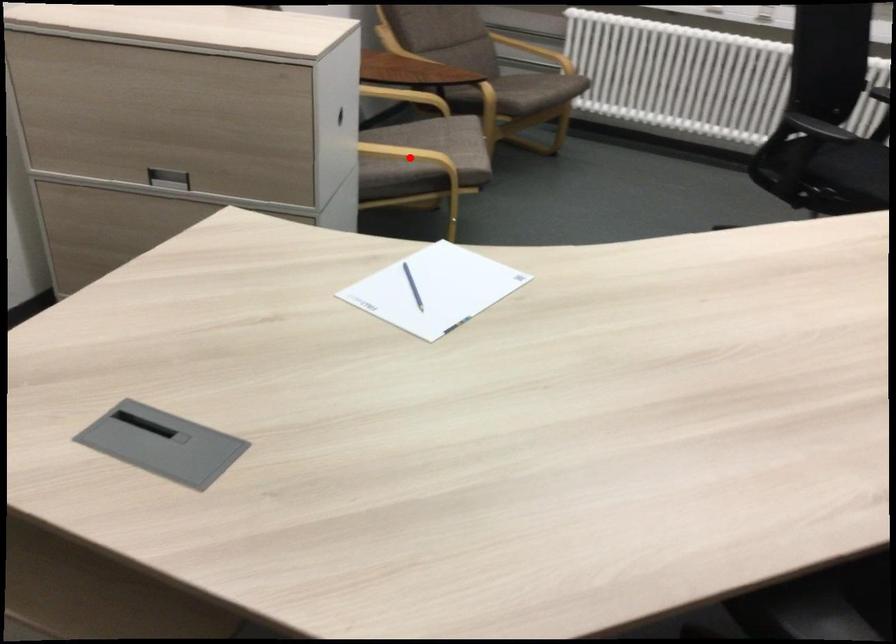
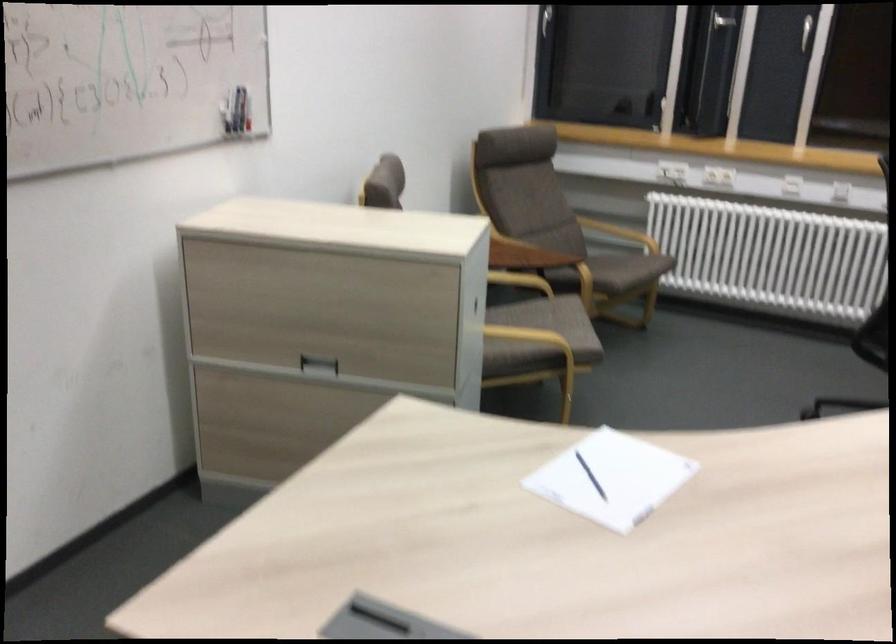
Question: I am providing you with two images of the same scene from different viewpoints. A red point is marked on the first image. Can you still see the location of the red point in image 2?

Choices:
 (A) Yes
 (B) No

Answer: (A)